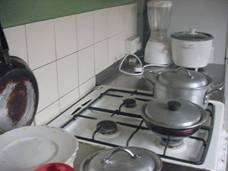
At what (x,y) coordinates should I click in order to perform the action: click on pot. Please return your answer as a coordinate pair (x, y). This screenshot has height=171, width=228. Looking at the image, I should click on (x=196, y=85).